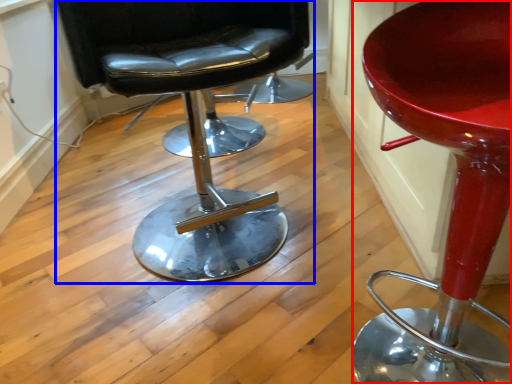
Question: Which object is further to the camera taking this photo, chair (highlighted by a red box) or chair (highlighted by a blue box)?

Choices:
 (A) chair
 (B) chair

Answer: (B)